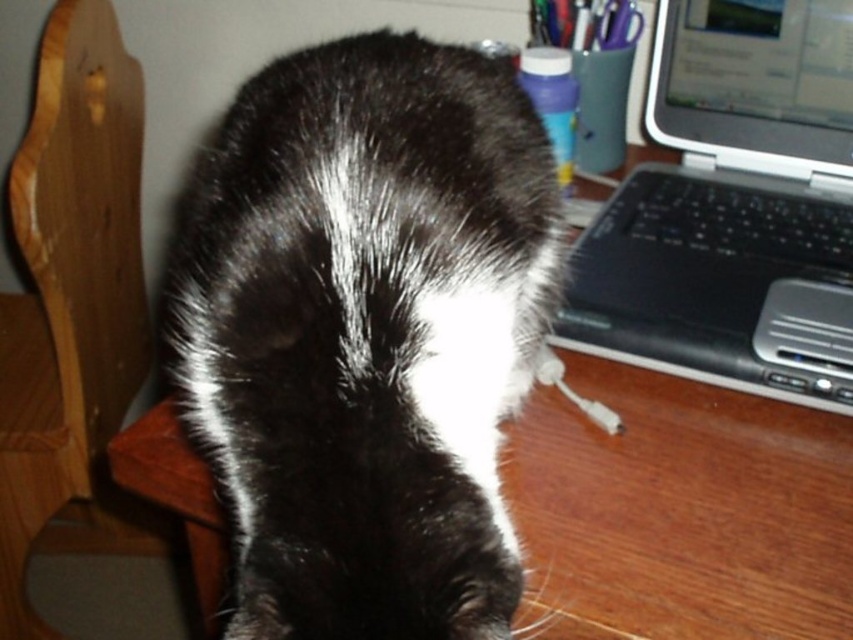
You are a photographer trying to capture the black fur cat at center and the wooden chair at left in the same frame. Based on their sizes, which object will appear larger in the photo?

The wooden chair at left will appear larger in the photo because the black fur cat at center is smaller than the wooden chair at left.

You are a photographer trying to capture the black fur cat at center and the black plastic laptop at right in the same frame. Based on their positions, can you tell if the cat is in front of or behind the laptop?

The black fur cat at center is positioned under the black plastic laptop at right, so the cat is behind the laptop in the frame.

You are trying to place a small toy mouse exactly where the black fur cat at center is sitting. According to the coordinates provided, where should you place the toy mouse?

The black fur cat at center is located at point (366, 333), so you should place the toy mouse at those coordinates to match its position.